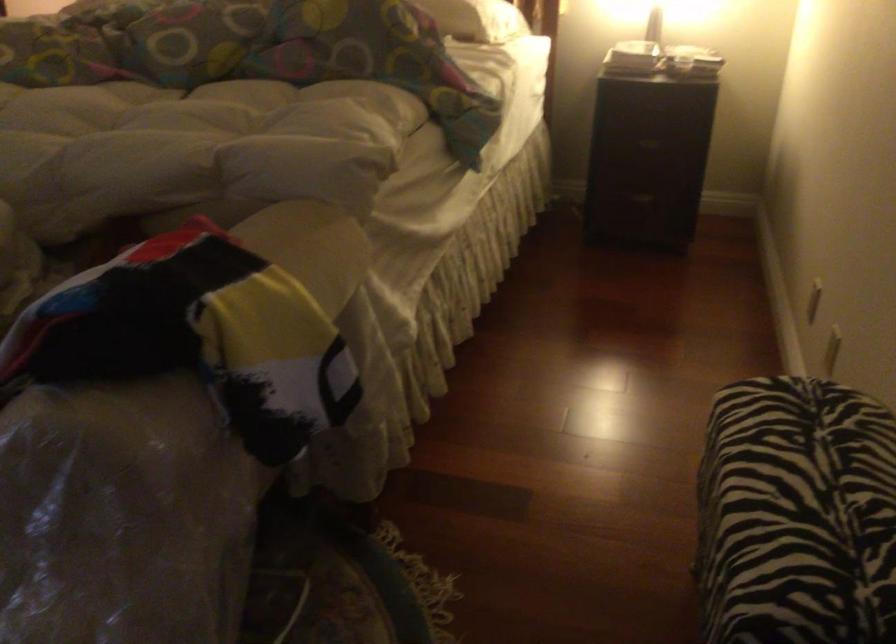
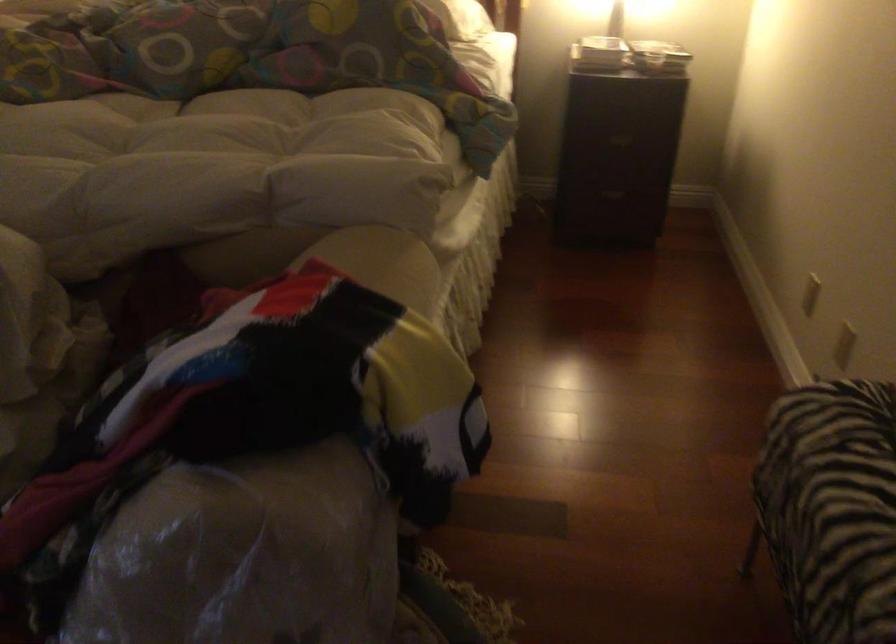
In the second image, find the point that corresponds to point (730, 500) in the first image.

(831, 507)